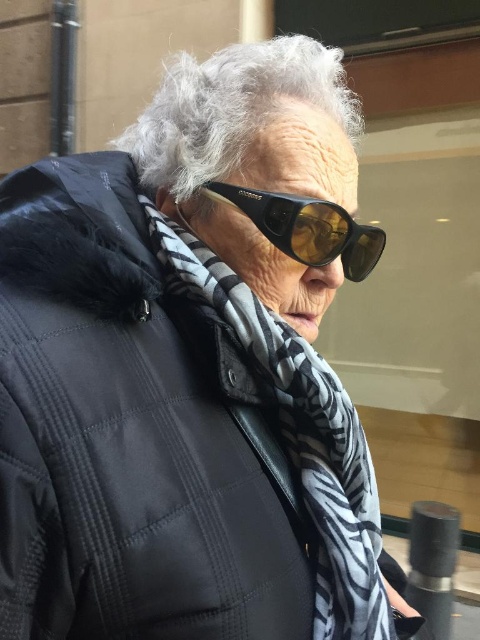
Question: In this image, where is gray curly hair at upper center located relative to black matte sunglasses at center?

Choices:
 (A) above
 (B) below

Answer: (A)

Question: Based on their relative distances, which object is nearer to the black and white patterned scarf at center?

Choices:
 (A) gray curly hair at upper center
 (B) black matte sunglasses at center

Answer: (B)

Question: In this image, where is gray curly hair at upper center located relative to black matte sunglasses at center?

Choices:
 (A) below
 (B) above

Answer: (B)

Question: Does gray curly hair at upper center come in front of black matte sunglasses at center?

Choices:
 (A) yes
 (B) no

Answer: (B)

Question: Which of the following is the farthest from the observer?

Choices:
 (A) black matte sunglasses at center
 (B) black and white patterned scarf at center

Answer: (A)

Question: Among these objects, which one is nearest to the camera?

Choices:
 (A) gray curly hair at upper center
 (B) black and white patterned scarf at center

Answer: (B)